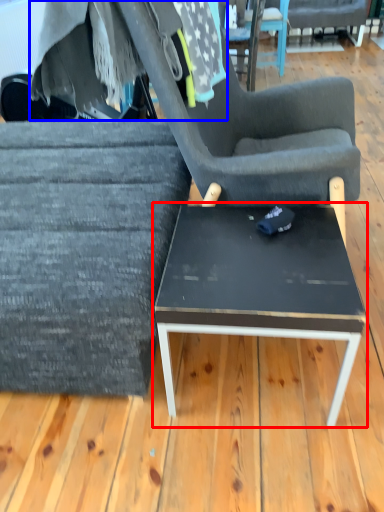
Question: Which object appears closest to the camera in this image, coffee table (highlighted by a red box) or fabric (highlighted by a blue box)?

Choices:
 (A) coffee table
 (B) fabric

Answer: (A)